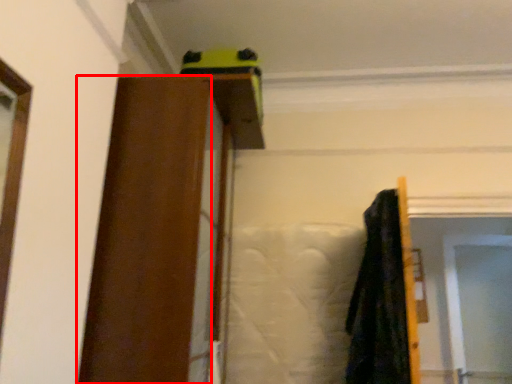
Question: From the image's perspective, where is barn door (annotated by the red box) located in relation to screen door in the image?

Choices:
 (A) below
 (B) above

Answer: (B)